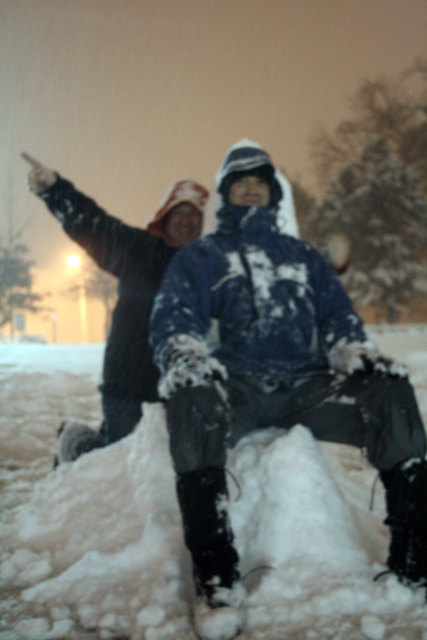
Question: Observing the image, what is the correct spatial positioning of snow-covered jacket at center in reference to dark blue snow-covered jacket at left?

Choices:
 (A) below
 (B) above

Answer: (A)

Question: Which point is farther to the camera?

Choices:
 (A) snow-covered jacket at center
 (B) dark blue snow-covered jacket at left

Answer: (B)

Question: Which object appears farthest from the camera in this image?

Choices:
 (A) snow-covered jacket at center
 (B) dark blue snow-covered jacket at left

Answer: (B)

Question: Does snow-covered jacket at center lie in front of dark blue snow-covered jacket at left?

Choices:
 (A) no
 (B) yes

Answer: (B)

Question: Among these points, which one is farthest from the camera?

Choices:
 (A) (178, 419)
 (B) (111, 353)

Answer: (B)

Question: Can you confirm if snow-covered jacket at center is positioned above dark blue snow-covered jacket at left?

Choices:
 (A) no
 (B) yes

Answer: (A)